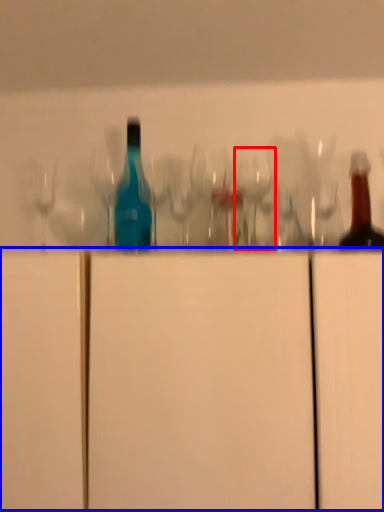
Question: Which object appears farthest to the camera in this image, wine glass (highlighted by a red box) or cabinetry (highlighted by a blue box)?

Choices:
 (A) wine glass
 (B) cabinetry

Answer: (A)